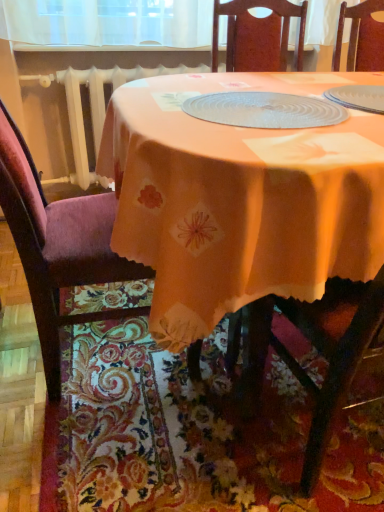
Where is `free point in front of clear plastic placemat at center`? The image size is (384, 512). free point in front of clear plastic placemat at center is located at coordinates (279, 143).